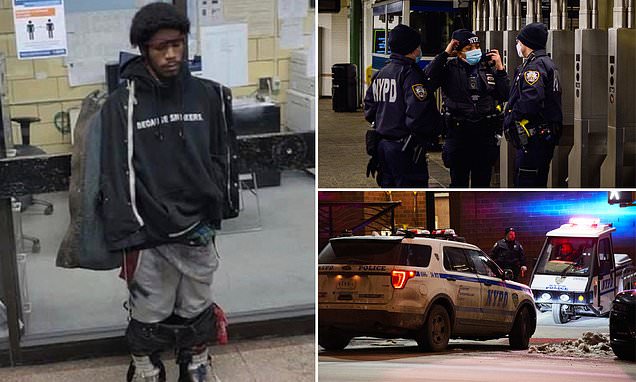
The height and width of the screenshot is (382, 636). I want to click on lights, so click(413, 229), click(434, 233), click(586, 220).